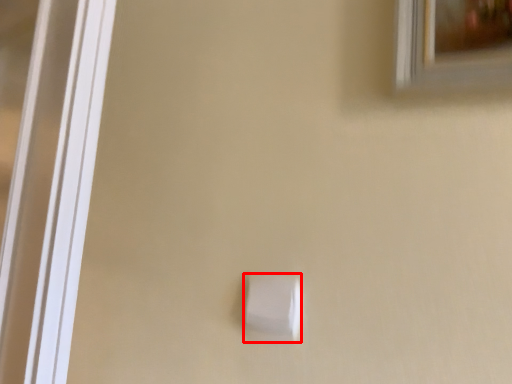
Question: From the image's perspective, where is light switch (annotated by the red box) located in relation to window in the image?

Choices:
 (A) above
 (B) below

Answer: (B)